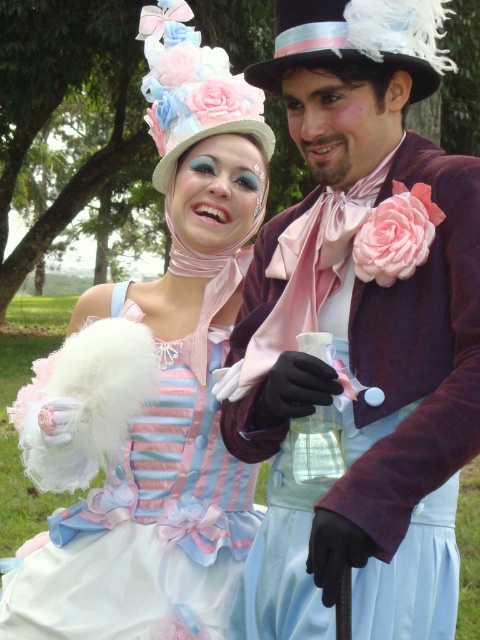
Does point (279, 316) come behind point (348, 49)?

Yes, it is behind point (348, 49).

The image size is (480, 640). Identify the location of matte purple coat at center. (360, 332).

Can you confirm if pastel striped fabric dress at center is shorter than black felt dress hat at upper center?

No.

Where is `pastel striped fabric dress at center`? pastel striped fabric dress at center is located at coordinates (171, 464).

Is point (31, 529) less distant than point (410, 74)?

No, it is behind (410, 74).

The width and height of the screenshot is (480, 640). I want to click on pastel striped fabric dress at center, so click(171, 464).

What do you see at coordinates (360, 332) in the screenshot? I see `matte purple coat at center` at bounding box center [360, 332].

Locate an element on the screen. matte purple coat at center is located at coordinates (360, 332).